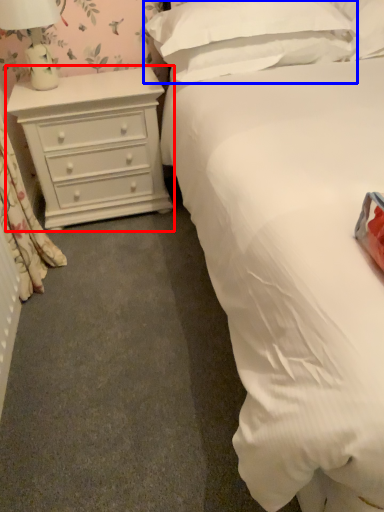
Question: Among these objects, which one is nearest to the camera, chest of drawers (highlighted by a red box) or pillow (highlighted by a blue box)?

Choices:
 (A) chest of drawers
 (B) pillow

Answer: (B)